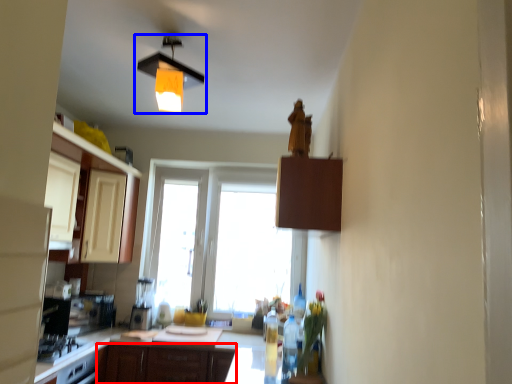
Question: Which object appears farthest to the camera in this image, cabinetry (highlighted by a red box) or lamp (highlighted by a blue box)?

Choices:
 (A) cabinetry
 (B) lamp

Answer: (A)